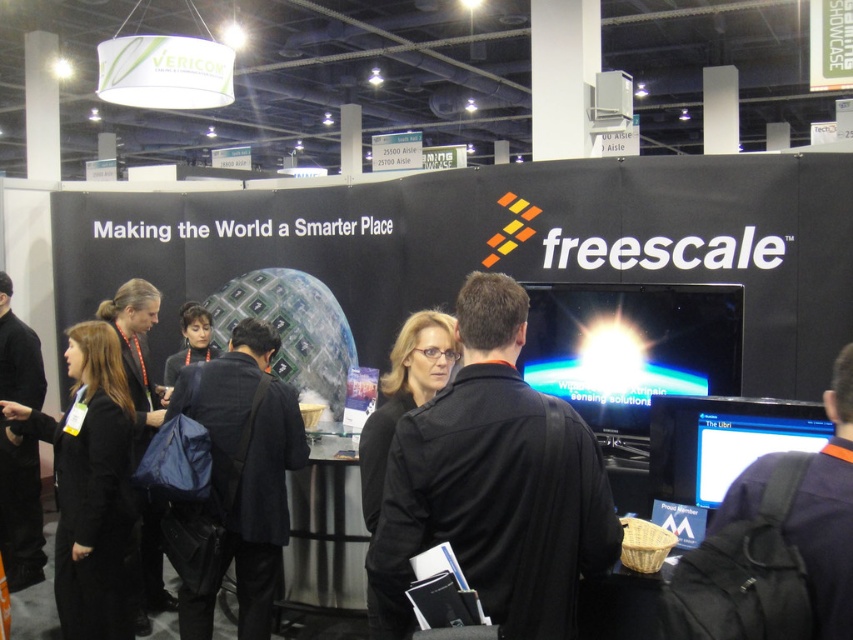
Question: Which object is closer to the camera taking this photo?

Choices:
 (A) black fabric jacket at center
 (B) black fabric at center
 (C) black fabric coat at center

Answer: (B)

Question: Which object appears closest to the camera in this image?

Choices:
 (A) black fabric coat at center
 (B) black fabric jacket at center
 (C) black fabric at center

Answer: (C)

Question: Based on their relative distances, which object is farther from the black fabric coat at center?

Choices:
 (A) black fabric at center
 (B) black fabric jacket at center

Answer: (A)

Question: In this image, where is black fabric jacket at center located relative to black fabric coat at center?

Choices:
 (A) above
 (B) below

Answer: (A)

Question: Does black fabric at center appear under black fabric jacket at center?

Choices:
 (A) yes
 (B) no

Answer: (B)

Question: Can you confirm if black fabric at center is wider than black fabric coat at center?

Choices:
 (A) yes
 (B) no

Answer: (A)